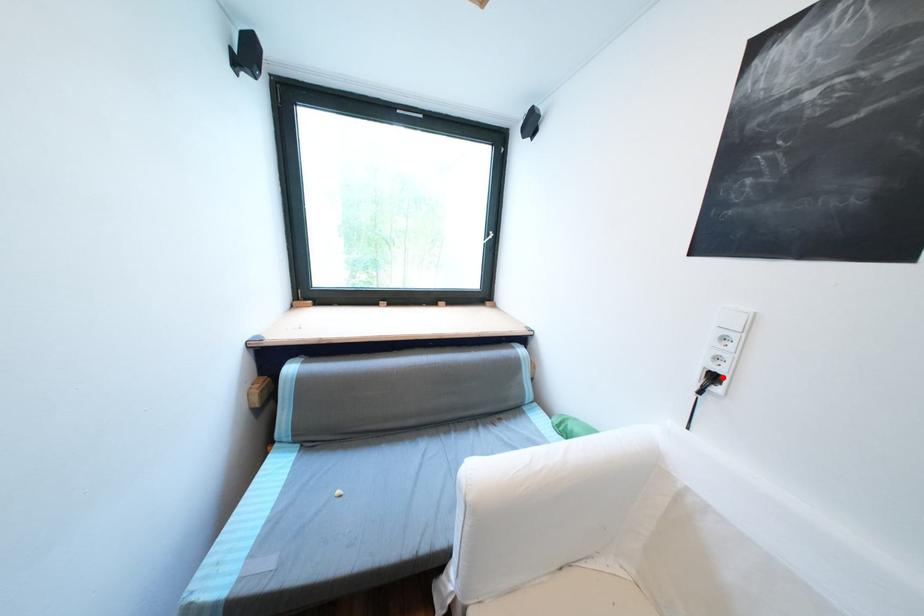
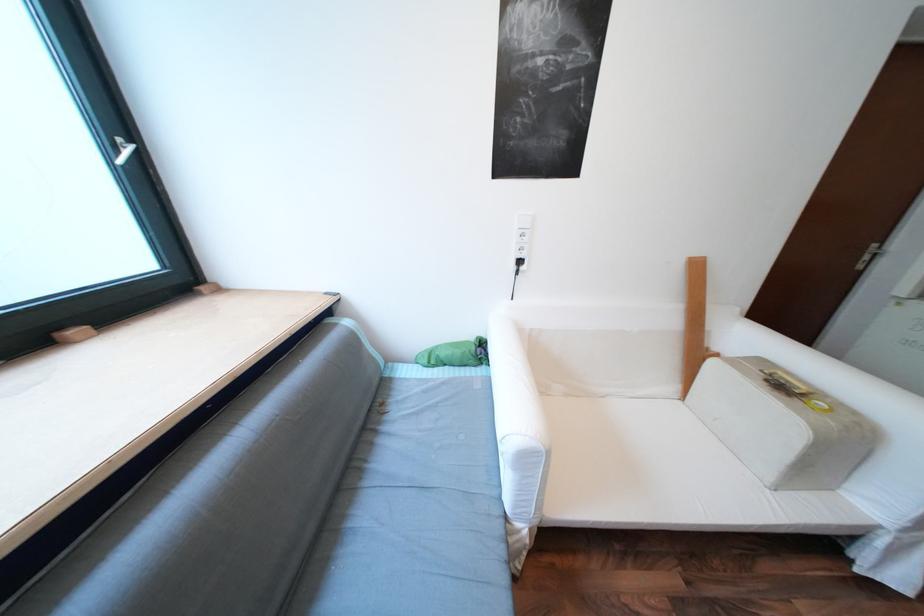
Where in the second image is the point corresponding to the highlighted location from the first image?

(529, 262)